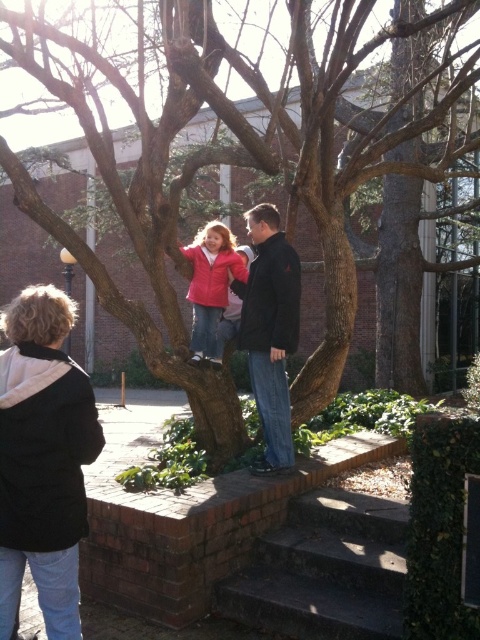
You are a park ranger assessing safety conditions. You notice the brown rough tree trunk at center and the matte red jacket at center. Which object is shorter in height?

The brown rough tree trunk at center is shorter than the matte red jacket at center.

Consider the image. You are a photographer positioned at the base of the brown rough tree trunk at center. You want to take a photo of the black fleece jacket at lower left without the tree trunk blocking it. Is this possible?

The black fleece jacket at lower left is behind the brown rough tree trunk at center, so it is currently blocked by the tree trunk. To capture the jacket without obstruction, you would need to reposition yourself or the subject so that the jacket is no longer behind the trunk.

You are standing at the brick platform and want to reach the tree trunk. There are two points marked as point 1 at coordinates point (226, 97) and point 2 at coordinates point (60, 385). Which point should you move towards first to get closer to the tree trunk?

Point (60, 385) should be moved towards first because point (226, 97) is behind point (60, 385), meaning point (60, 385) is closer to the tree trunk.